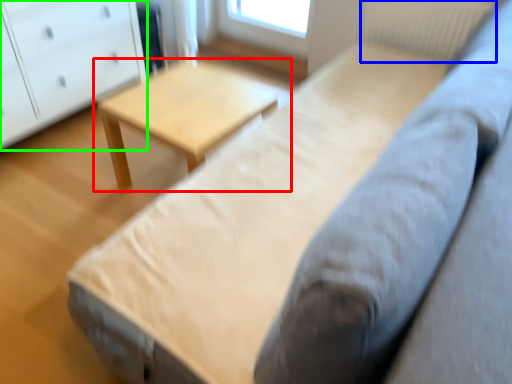
Question: Estimate the real-world distances between objects in this image. Which object is farther from table (highlighted by a red box), radiator (highlighted by a blue box) or chest of drawers (highlighted by a green box)?

Choices:
 (A) radiator
 (B) chest of drawers

Answer: (A)